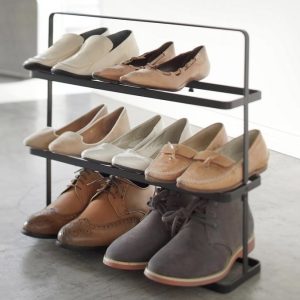
The height and width of the screenshot is (300, 300). Find the location of `shoes on middle shelf`. shoes on middle shelf is located at coordinates (190, 180), (176, 166), (134, 163), (103, 149), (69, 145), (46, 139).